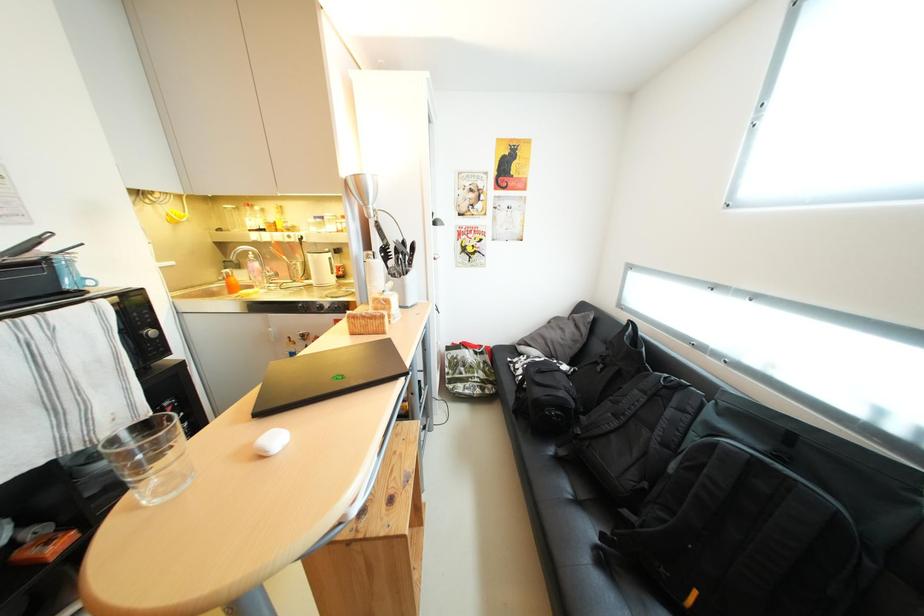
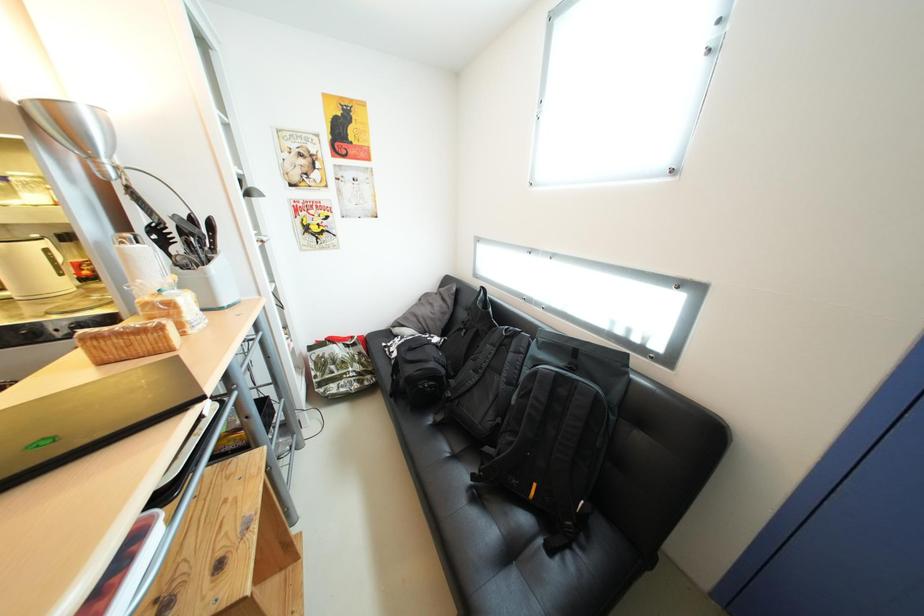
Question: In a continuous first-person perspective shot, in which direction is the camera moving?

Choices:
 (A) Left
 (B) Right
 (C) Forward
 (D) Backward

Answer: (B)